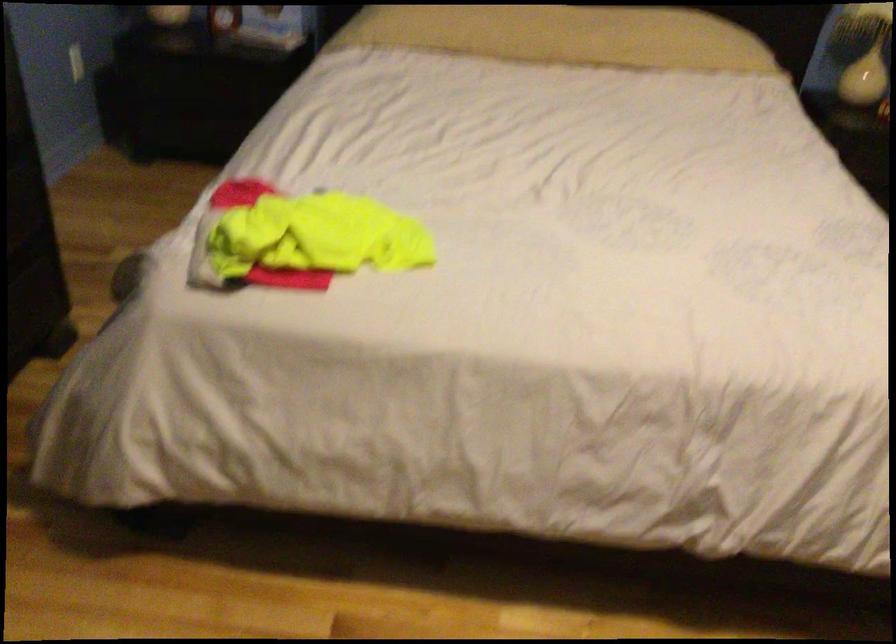
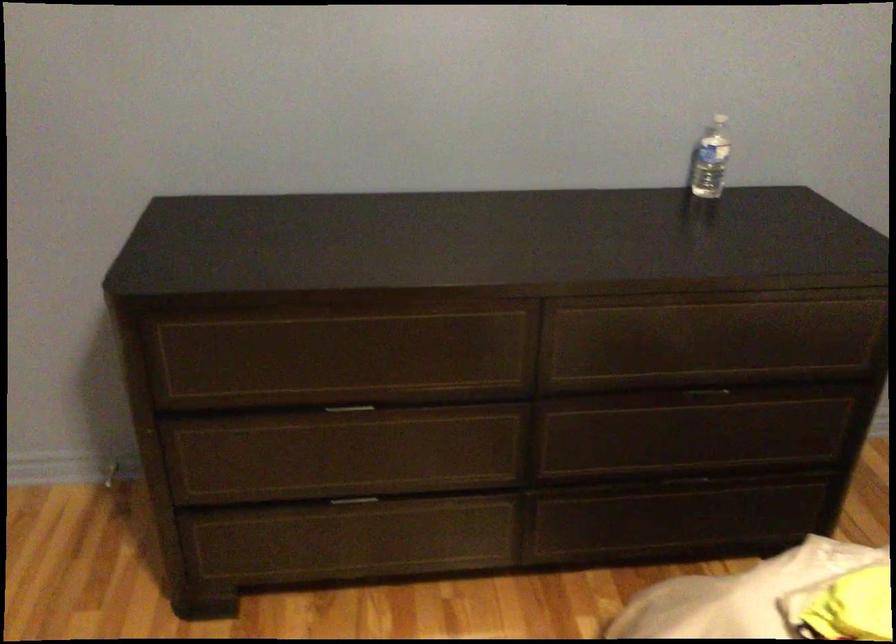
How did the camera likely rotate?

The camera's rotation is toward left-down.